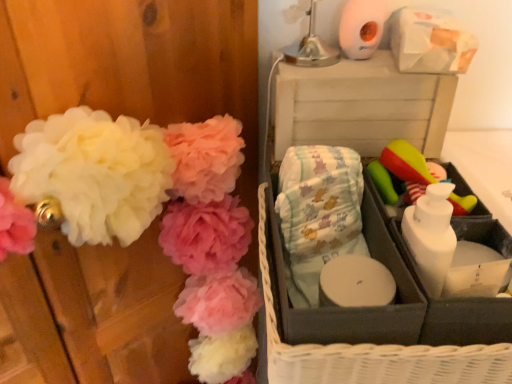
Identify the location of vacant space in front of white matte toilet paper at upper right. This screenshot has height=384, width=512. [366, 70].